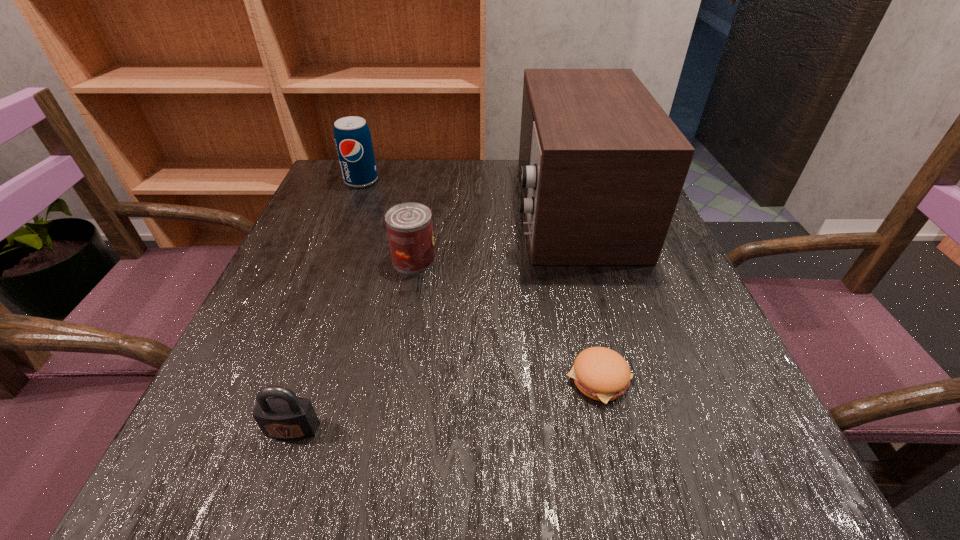
In order to click on object that is at the near left corner in this screenshot , I will do `click(284, 416)`.

Where is `object that is at the far right corner`? The width and height of the screenshot is (960, 540). object that is at the far right corner is located at coordinates (602, 166).

Image resolution: width=960 pixels, height=540 pixels. Identify the location of vacant space at the far edge. (394, 174).

Image resolution: width=960 pixels, height=540 pixels. Identify the location of vacant space at the left edge. (x=363, y=237).

In order to click on vacant space at the right edge of the desktop in this screenshot , I will do `click(674, 412)`.

The height and width of the screenshot is (540, 960). What are the coordinates of `free region at the far left corner of the desktop` in the screenshot? It's located at (336, 170).

In the image, there is a desktop. At what (x,y) coordinates should I click in order to perform the action: click on vacant space at the near right corner. Please return your answer as a coordinate pair (x, y). This screenshot has height=540, width=960. Looking at the image, I should click on (680, 495).

What are the coordinates of `empty space that is in between the radio receiver and the patty` in the screenshot? It's located at (586, 294).

Identify the location of unoccupied position between the shortest object and the pop. (480, 280).

Where is `free point between the second nearest object and the fourth shortest object`? The height and width of the screenshot is (540, 960). free point between the second nearest object and the fourth shortest object is located at coordinates (480, 280).